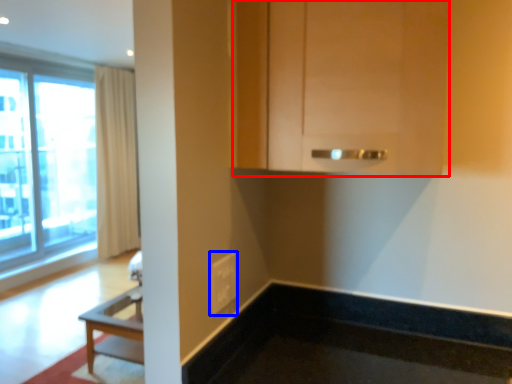
Question: Which object appears farthest to the camera in this image, cabinetry (highlighted by a red box) or electric outlet (highlighted by a blue box)?

Choices:
 (A) cabinetry
 (B) electric outlet

Answer: (B)